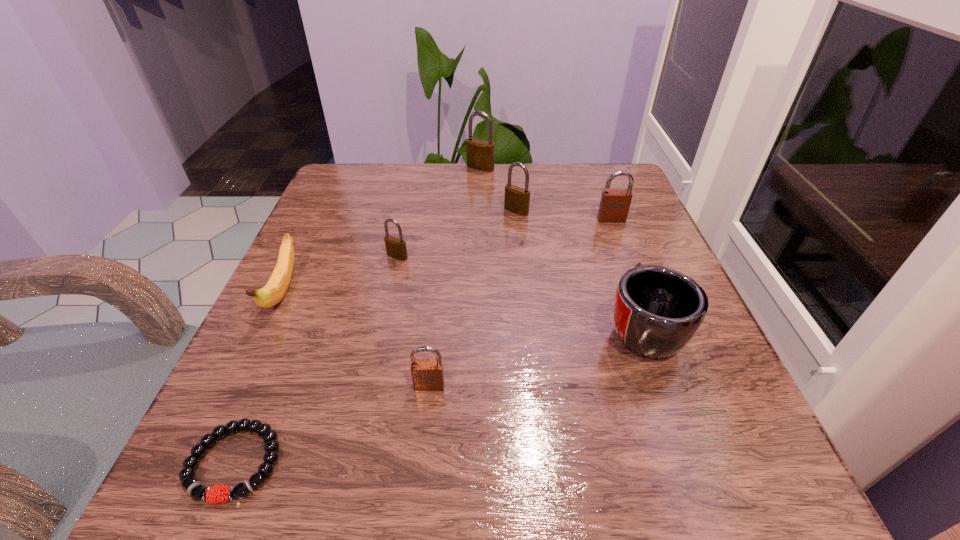
Where is `vacant area that lies between the leftmost brass padlock and the fourth padlock from left to right`? The height and width of the screenshot is (540, 960). vacant area that lies between the leftmost brass padlock and the fourth padlock from left to right is located at coordinates (457, 233).

Locate an element on the screen. The width and height of the screenshot is (960, 540). vacant space that's between the left brown padlock and the banana is located at coordinates (356, 339).

I want to click on blank region between the fourth object from left to right and the leftmost brass padlock, so click(414, 321).

I want to click on free point between the nearest object and the second padlock from left to right, so click(x=332, y=424).

Identify the location of free space between the right brown padlock and the black bracelet. (423, 341).

The image size is (960, 540). In order to click on free spot between the sixth object from right to left and the yellow banana in this screenshot , I will do `click(340, 274)`.

Identify the location of object that stands as the sixth closest to the tallest padlock. (427, 374).

Locate an element on the screen. The height and width of the screenshot is (540, 960). the fourth closest object to the second brass padlock from left to right is located at coordinates (657, 310).

Locate an element on the screen. Image resolution: width=960 pixels, height=540 pixels. the closest padlock to the farthest brass padlock is located at coordinates (517, 199).

I want to click on the fourth closest padlock to the fourth object from right to left, so click(427, 374).